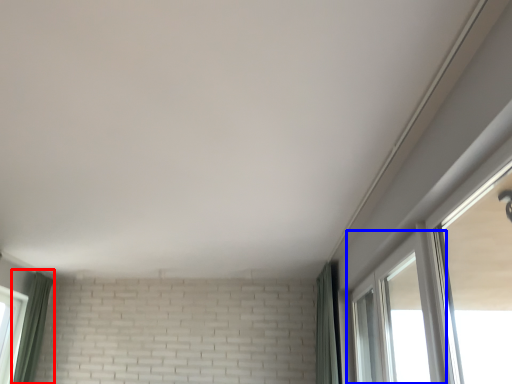
Question: Which of the following is the farthest to the observer, curtain (highlighted by a red box) or window (highlighted by a blue box)?

Choices:
 (A) curtain
 (B) window

Answer: (A)